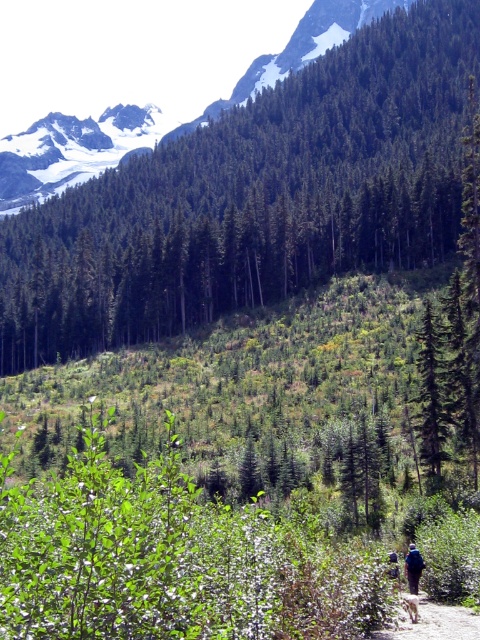
You are standing at the point marked by point (x=254, y=196) in the image. What object are you facing?

You are facing the green matte tree at center marked by point (x=254, y=196).

You are planning to walk along the dirt path at lower right while avoiding the green matte tree at center. Which one is wider so you can plan your path accordingly?

The green matte tree at center is wider than the dirt path at lower right, so you should avoid the tree by staying on the narrower dirt path at lower right.

You are a hiker who wants to take a photo of the green matte tree at center and the blue fabric backpack at lower right. Which object should you focus on first if you want both to be in sharp focus?

The green matte tree at center is taller than the blue fabric backpack at lower right, so you should focus on the green matte tree at center first to ensure both are in sharp focus.